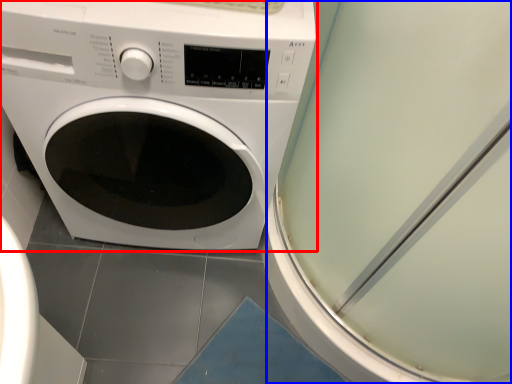
Question: Which object is further to the camera taking this photo, washing machine (highlighted by a red box) or screen door (highlighted by a blue box)?

Choices:
 (A) washing machine
 (B) screen door

Answer: (A)